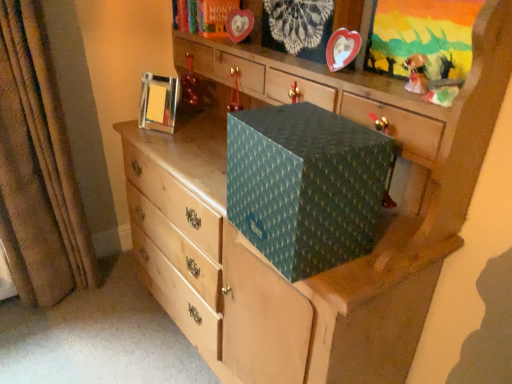
Question: From a real-world perspective, does metallic heart-shaped frame at upper center, positioned as the second picture frame in back-to-front order, sit lower than metallic red ornament at upper center, the 1th toy positioned from the top?

Choices:
 (A) yes
 (B) no

Answer: (B)

Question: Does metallic heart-shaped frame at upper center, positioned as the second picture frame in back-to-front order, have a greater width compared to metallic red ornament at upper center, arranged as the second toy when viewed from the front?

Choices:
 (A) no
 (B) yes

Answer: (A)

Question: Is metallic heart-shaped frame at upper center, which appears as the 1th picture frame when viewed from the front, at the left side of metallic red ornament at upper center, placed as the second toy when sorted from bottom to top?

Choices:
 (A) yes
 (B) no

Answer: (B)

Question: Considering the relative sizes of metallic heart-shaped frame at upper center, which is counted as the 2th picture frame, starting from the left, and metallic red ornament at upper center, which is the 2th toy from right to left, in the image provided, is metallic heart-shaped frame at upper center, which is counted as the 2th picture frame, starting from the left, shorter than metallic red ornament at upper center, which is the 2th toy from right to left,?

Choices:
 (A) no
 (B) yes

Answer: (B)

Question: Is metallic heart-shaped frame at upper center, which appears as the 1th picture frame when viewed from the front, thinner than metallic red ornament at upper center, arranged as the second toy when viewed from the front?

Choices:
 (A) yes
 (B) no

Answer: (A)

Question: Is metallic heart-shaped frame at upper center, positioned as the second picture frame in back-to-front order, facing towards metallic red ornament at upper center, placed as the first toy when sorted from back to front?

Choices:
 (A) yes
 (B) no

Answer: (B)

Question: Does shiny gold figurine at upper right, the 1th toy in the bottom-to-top sequence, come in front of brown textured curtain at left?

Choices:
 (A) no
 (B) yes

Answer: (B)

Question: Is shiny gold figurine at upper right, marked as the 1th toy in a front-to-back arrangement, in contact with brown textured curtain at left?

Choices:
 (A) no
 (B) yes

Answer: (A)

Question: Does shiny gold figurine at upper right, the 1th toy in the right-to-left sequence, have a larger size compared to brown textured curtain at left?

Choices:
 (A) no
 (B) yes

Answer: (A)

Question: Considering the relative positions of shiny gold figurine at upper right, marked as the 1th toy in a front-to-back arrangement, and brown textured curtain at left in the image provided, is shiny gold figurine at upper right, marked as the 1th toy in a front-to-back arrangement, to the left of brown textured curtain at left from the viewer's perspective?

Choices:
 (A) no
 (B) yes

Answer: (A)

Question: Is the position of shiny gold figurine at upper right, the 1th toy in the right-to-left sequence, more distant than that of brown textured curtain at left?

Choices:
 (A) no
 (B) yes

Answer: (A)

Question: From a real-world perspective, is shiny gold figurine at upper right, the 1th toy in the right-to-left sequence, below brown textured curtain at left?

Choices:
 (A) no
 (B) yes

Answer: (A)

Question: Is metallic silver picture frame at upper left, the 1th picture frame positioned from the left, smaller than metallic red ornament at upper center, which is the 2th toy from right to left?

Choices:
 (A) yes
 (B) no

Answer: (B)